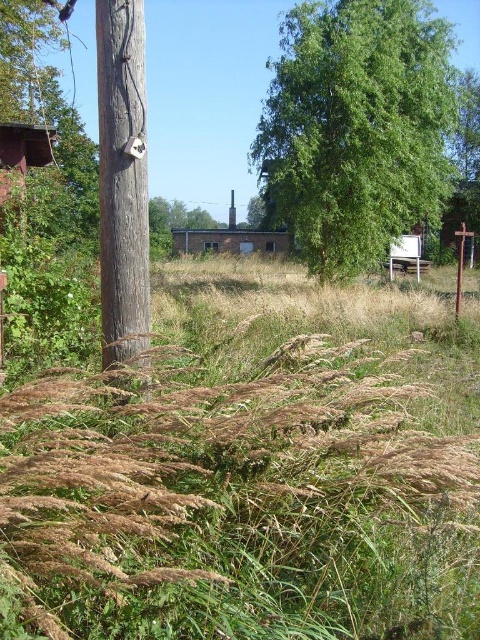
Question: Which of the following is the farthest from the observer?

Choices:
 (A) green leafy tree at upper right
 (B) brown dry grass at lower left

Answer: (A)

Question: Does brown dry grass at lower left have a smaller size compared to brown wooden post at left?

Choices:
 (A) no
 (B) yes

Answer: (A)

Question: Which of the following is the closest to the observer?

Choices:
 (A) brown wooden post at left
 (B) green leafy tree at upper right
 (C) brown dry grass at lower left

Answer: (C)

Question: Which point appears closest to the camera in this image?

Choices:
 (A) (139, 257)
 (B) (326, 17)

Answer: (A)

Question: Is brown dry grass at lower left closer to camera compared to green leafy tree at upper right?

Choices:
 (A) no
 (B) yes

Answer: (B)

Question: Can you confirm if brown dry grass at lower left is positioned below brown wooden post at left?

Choices:
 (A) yes
 (B) no

Answer: (B)